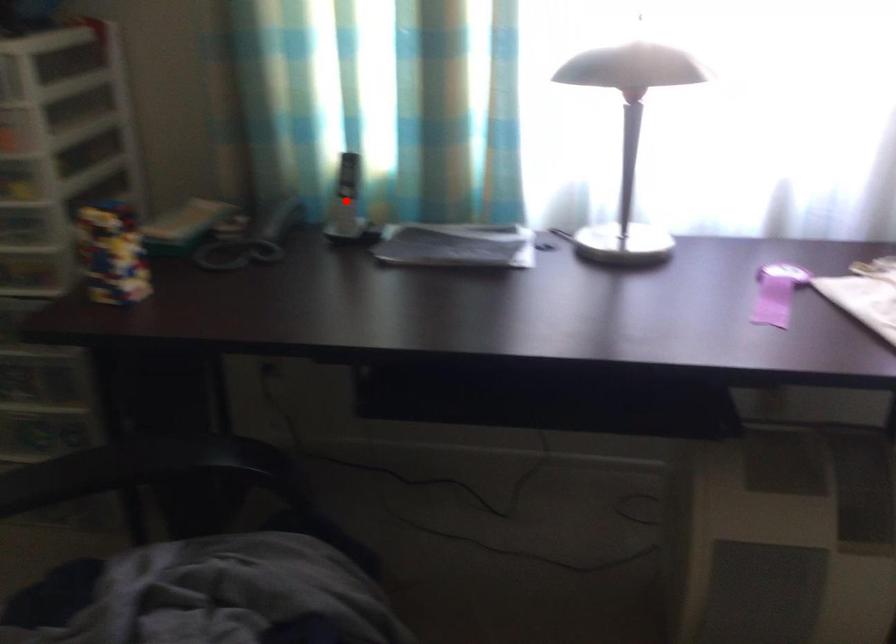
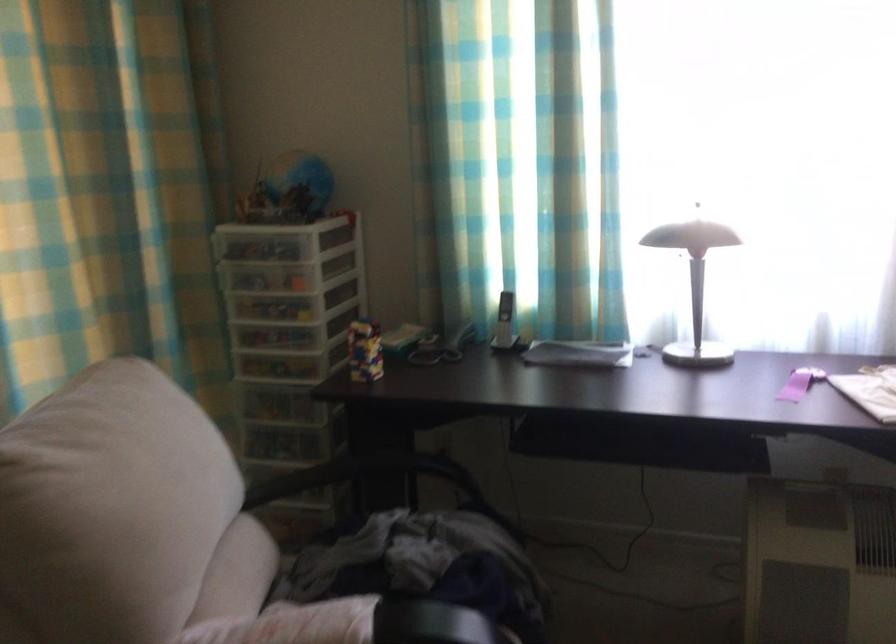
Question: I am providing you with two images of the same scene from different viewpoints. Given a red point in image1, look at the same physical point in image2. Is it:

Choices:
 (A) Closer to the viewpoint
 (B) Farther from the viewpoint

Answer: (B)